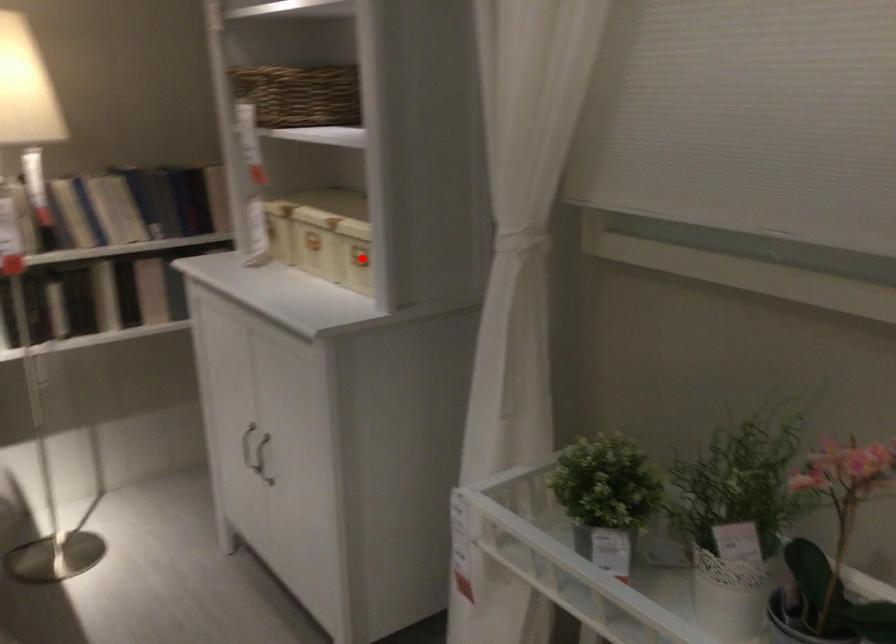
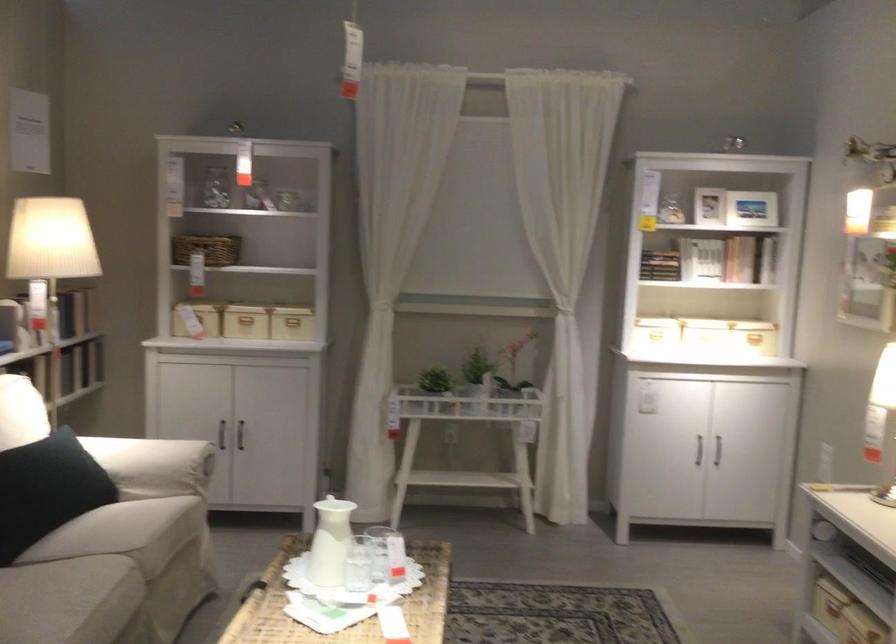
Find the pixel in the second image that matches the highlighted location in the first image.

(291, 321)